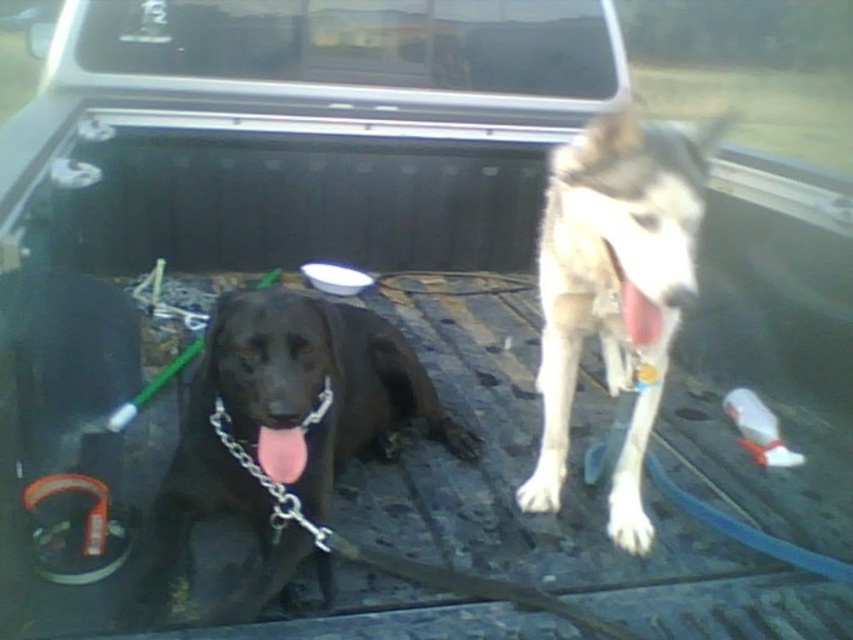
Can you confirm if shiny black dog at center is taller than white fur dog at center?

Incorrect, shiny black dog at center's height is not larger of white fur dog at center's.

Does shiny black dog at center come in front of white fur dog at center?

No.

Describe the element at coordinates (285, 426) in the screenshot. I see `shiny black dog at center` at that location.

Find the location of a particular element. Image resolution: width=853 pixels, height=640 pixels. shiny black dog at center is located at coordinates (285, 426).